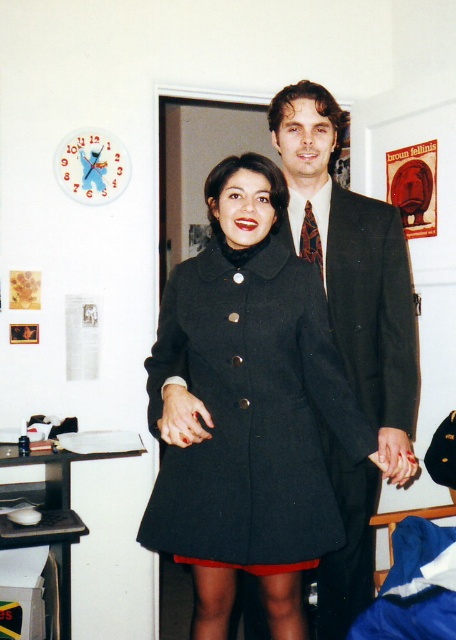
Does matte black coat at center come behind dark wool suit at center?

No, it is not.

Which of these two, matte black coat at center or dark wool suit at center, stands taller?

Standing taller between the two is dark wool suit at center.

Identify the location of matte black coat at center. This screenshot has width=456, height=640. (249, 412).